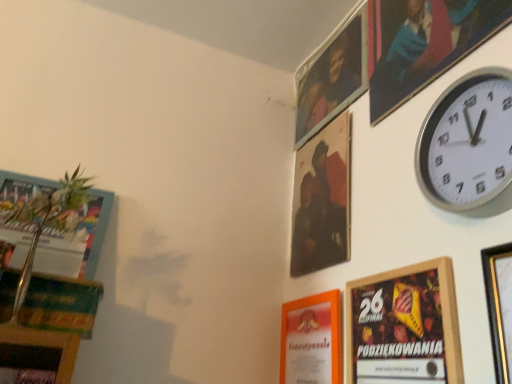
Question: Is gold metallic picture frame at upper right, which is the 6th picture frame from back to front, oriented away from metallic silver picture frame at upper right, the sixth picture frame in the front-to-back sequence?

Choices:
 (A) no
 (B) yes

Answer: (A)

Question: Is gold metallic picture frame at upper right, which is the 6th picture frame from back to front, positioned before metallic silver picture frame at upper right, which is the first picture frame from back to front?

Choices:
 (A) yes
 (B) no

Answer: (A)

Question: From the image's perspective, is gold metallic picture frame at upper right, the first picture frame when ordered from front to back, under metallic silver picture frame at upper right, the sixth picture frame in the front-to-back sequence?

Choices:
 (A) yes
 (B) no

Answer: (A)

Question: Is gold metallic picture frame at upper right, the first picture frame when ordered from front to back, bigger than metallic silver picture frame at upper right, which is the first picture frame from back to front?

Choices:
 (A) yes
 (B) no

Answer: (B)

Question: Considering the relative positions of gold metallic picture frame at upper right, which is the 6th picture frame from back to front, and metallic silver picture frame at upper right, which is the first picture frame from back to front, in the image provided, is gold metallic picture frame at upper right, which is the 6th picture frame from back to front, to the right of metallic silver picture frame at upper right, which is the first picture frame from back to front, from the viewer's perspective?

Choices:
 (A) no
 (B) yes

Answer: (B)

Question: From a real-world perspective, is silver metallic wall clock at upper right positioned above or below wooden picture frame at upper right, the fourth picture frame positioned from the back?

Choices:
 (A) below
 (B) above

Answer: (A)

Question: From the image's perspective, relative to wooden picture frame at upper right, the fourth picture frame positioned from the back, is silver metallic wall clock at upper right above or below?

Choices:
 (A) above
 (B) below

Answer: (B)

Question: Considering the relative positions of silver metallic wall clock at upper right and wooden picture frame at upper right, which appears as the 3th picture frame when viewed from the front, in the image provided, is silver metallic wall clock at upper right to the left or to the right of wooden picture frame at upper right, which appears as the 3th picture frame when viewed from the front,?

Choices:
 (A) right
 (B) left

Answer: (B)

Question: Is silver metallic wall clock at upper right inside the boundaries of wooden picture frame at upper right, which appears as the 3th picture frame when viewed from the front, or outside?

Choices:
 (A) outside
 (B) inside

Answer: (A)

Question: Which is correct: wooden picture frame at upper right, which appears as the 3th picture frame when viewed from the front, is inside matte black portrait at upper center, which is counted as the fifth picture frame, starting from the front, or outside of it?

Choices:
 (A) outside
 (B) inside

Answer: (A)

Question: In terms of size, does wooden picture frame at upper right, which appears as the 3th picture frame when viewed from the front, appear bigger or smaller than matte black portrait at upper center, which appears as the 2th picture frame when viewed from the back?

Choices:
 (A) big
 (B) small

Answer: (A)

Question: Relative to matte black portrait at upper center, which appears as the 2th picture frame when viewed from the back, is wooden picture frame at upper right, which appears as the 3th picture frame when viewed from the front, in front or behind?

Choices:
 (A) behind
 (B) front

Answer: (B)

Question: Is wooden picture frame at upper right, the fourth picture frame positioned from the back, wider or thinner than matte black portrait at upper center, which is counted as the fifth picture frame, starting from the front?

Choices:
 (A) wide
 (B) thin

Answer: (B)

Question: Based on their sizes in the image, would you say wooden picture frame at upper right, which appears as the 3th picture frame when viewed from the front, is bigger or smaller than orange paper at lower center, the 4th picture frame from the front?

Choices:
 (A) small
 (B) big

Answer: (B)

Question: From a real-world perspective, relative to orange paper at lower center, placed as the 3th picture frame when sorted from back to front, is wooden picture frame at upper right, the fourth picture frame positioned from the back, vertically above or below?

Choices:
 (A) above
 (B) below

Answer: (A)